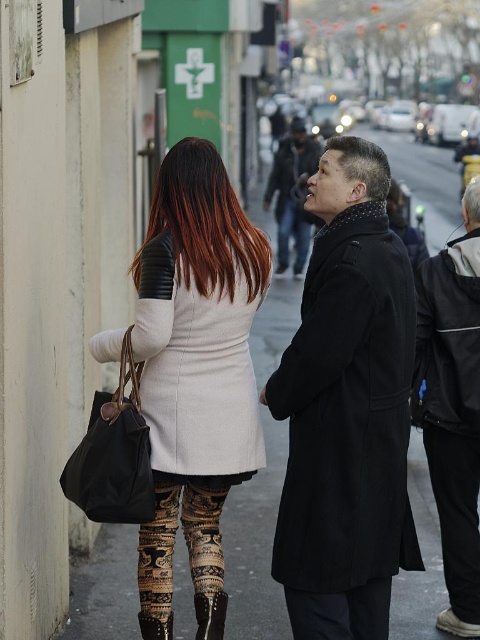
You are a delivery person trying to find the person wearing the black leather jacket at right. According to the scene description, where should you look relative to the other person?

The black leather jacket at right is located at point 0.652 on the horizontal axis and 0.942 on the vertical axis, so you should look towards the right side of the scene, slightly lower down, relative to the other person.

You are a photographer standing at the scene. You want to take a photo of the two people in the image so that both the brown textured leggings at lower center and the white matte hair at upper center are clearly visible in the frame. Given that your camera has a focal length of 50mm and a sensor size of 24mm x 36mm, what is the minimum distance you should stand from the subjects to ensure both elements are in focus, assuming a hyperfocal distance calculation with an aperture of f8 and acceptable sharpness?

The minimum distance you should stand from the subjects is approximately 9.79 feet. This ensures that both the brown textured leggings at lower center and the white matte hair at upper center are within the depth of field, as the hyperfocal distance calculation at f8 with the given sensor and lens specifications would require the camera to be at least as far away as the distance between the two objects to maintain both in focus.

You are standing at the point marked as point (452, 417) in the image. Which object is directly in front of you?

The point (452, 417) indicates the location of the black leather jacket at right, so the object directly in front of you is the black leather jacket at right.